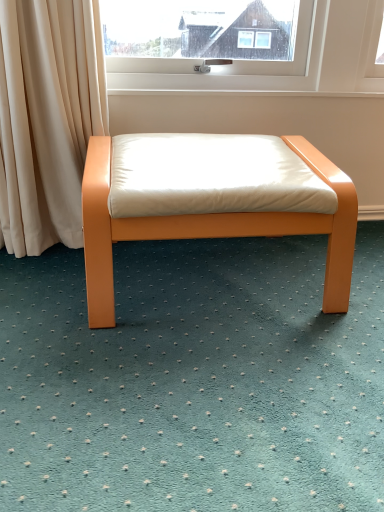
The image size is (384, 512). I want to click on free space in front of matte orange bench at center, so click(x=208, y=386).